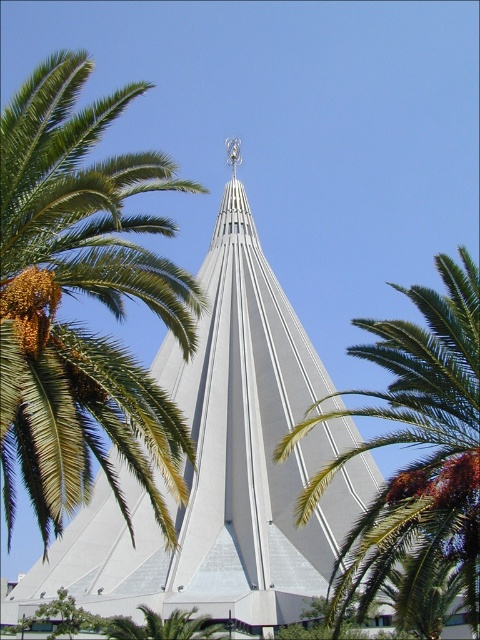
Question: Among these objects, which one is farthest from the camera?

Choices:
 (A) green leafy palm tree at upper left
 (B) green leafy palm tree at lower center
 (C) white smooth cone at center

Answer: (C)

Question: Among these points, which one is farthest from the camera?

Choices:
 (A) (92, 468)
 (B) (417, 596)
 (C) (213, 637)
 (D) (180, 392)

Answer: (A)

Question: Can you confirm if white smooth cone at center is thinner than green leafy palm tree at upper left?

Choices:
 (A) no
 (B) yes

Answer: (B)

Question: Is the position of green leafy palm tree at upper left less distant than that of green leafy palm tree at lower center?

Choices:
 (A) yes
 (B) no

Answer: (A)

Question: Considering the relative positions of green leafy palm tree at center and green leafy palm tree at lower center in the image provided, where is green leafy palm tree at center located with respect to green leafy palm tree at lower center?

Choices:
 (A) above
 (B) below

Answer: (A)

Question: Among these points, which one is farthest from the camera?

Choices:
 (A) (93, 196)
 (B) (327, 611)
 (C) (245, 492)
 (D) (117, 628)

Answer: (C)